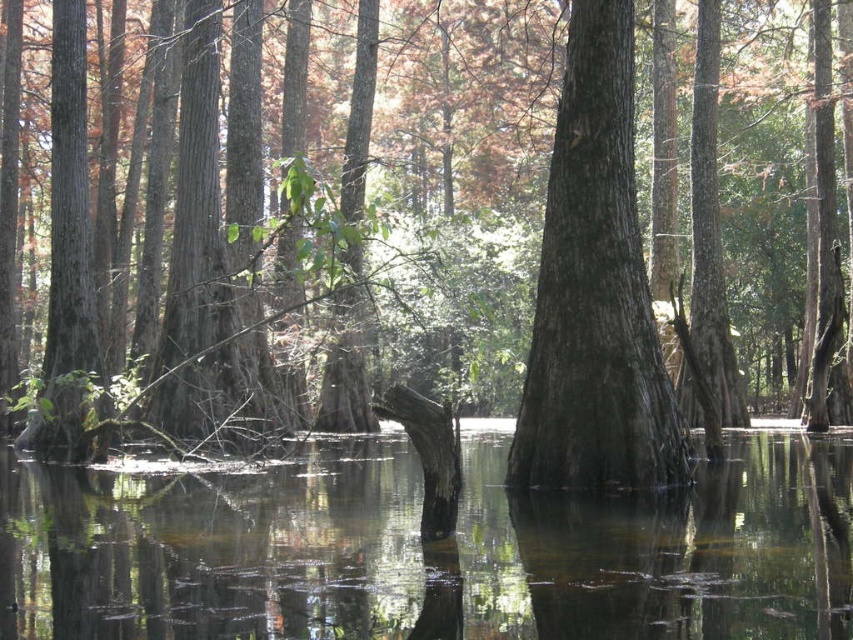
Question: Can you confirm if clear water at center is positioned to the right of smooth dark brown tree trunk at center?

Choices:
 (A) no
 (B) yes

Answer: (A)

Question: Can you confirm if clear water at center is positioned to the right of smooth dark brown tree trunk at center?

Choices:
 (A) no
 (B) yes

Answer: (A)

Question: Which point appears farthest from the camera in this image?

Choices:
 (A) (47, 538)
 (B) (576, 211)

Answer: (B)

Question: Observing the image, what is the correct spatial positioning of clear water at center in reference to smooth dark brown tree trunk at center?

Choices:
 (A) above
 (B) below

Answer: (B)